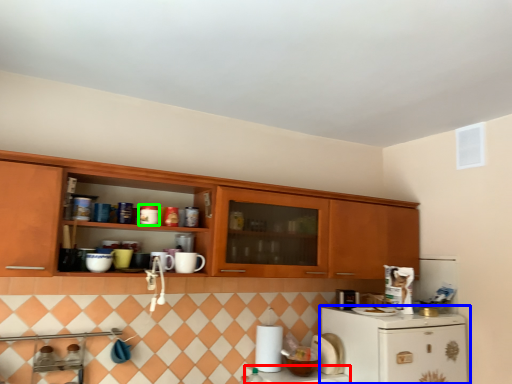
Question: Considering the real-world distances, which object is closest to counter top (highlighted by a red box)? refrigerator (highlighted by a blue box) or appliance (highlighted by a green box).

Choices:
 (A) refrigerator
 (B) appliance

Answer: (A)